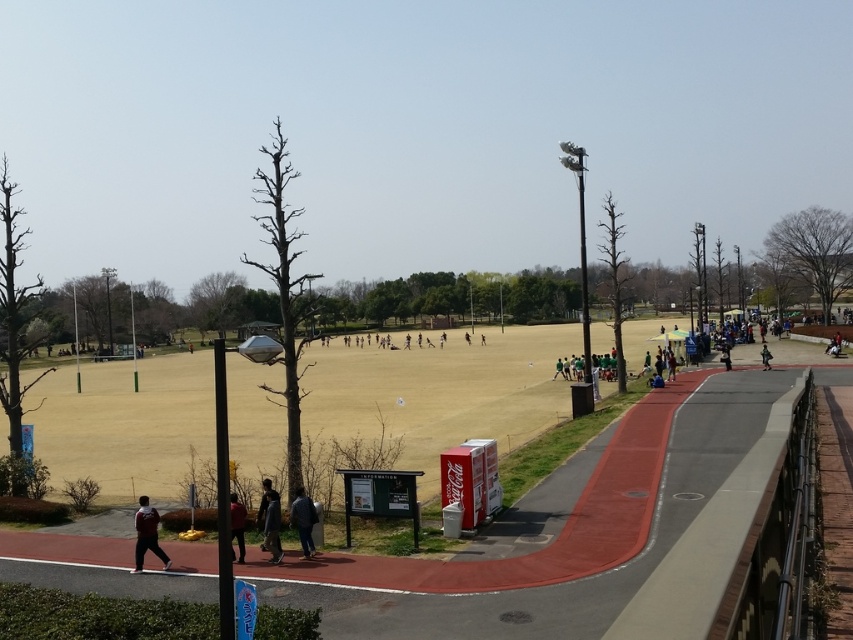
You are a photographer standing at the edge of the sports field. You want to take a photo that includes both the dark red jacket at lower left and the dark gray fabric jacket at lower center. Given that your camera has a maximum zoom range of 2 meters, will you be able to capture both subjects in a single frame without moving your position?

The distance between the dark red jacket at lower left and the dark gray fabric jacket at lower center is 2.17 meters. Since your camera can only zoom up to 2 meters, you will not be able to capture both subjects in a single frame without moving your position.

You are a photographer trying to capture a photo of both the dark blue fabric jacket at lower center and the dark gray jacket at center. Since you want to ensure both jackets are clearly visible in the frame, which jacket should you focus on first to account for their sizes?

The dark blue fabric jacket at lower center is wider than the dark gray jacket at center, so you should focus on the dark blue fabric jacket at lower center first to ensure its larger size is properly captured in the frame.